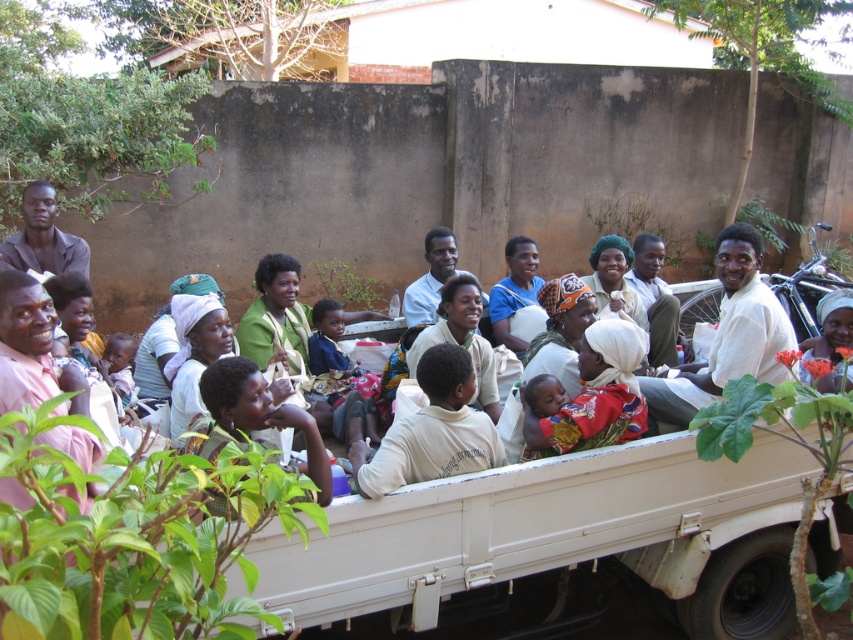
You are standing in front of the pickup truck and want to place a small gift at the location of point (746, 316) and point (466, 272). Which point is closer to you?

Point (746, 316) is closer to the viewer than point (466, 272), so you should place the gift at point (746, 316) first as it is nearer to you.

You are a photographer trying to capture a clear photo of the white matte shirt at center and the matte brown shirt at left. Which shirt should you focus on first to ensure it appears sharp in the photo?

The white matte shirt at center is closer to the viewer than the matte brown shirt at left, so you should focus on the white matte shirt at center first to ensure it appears sharp in the photo.